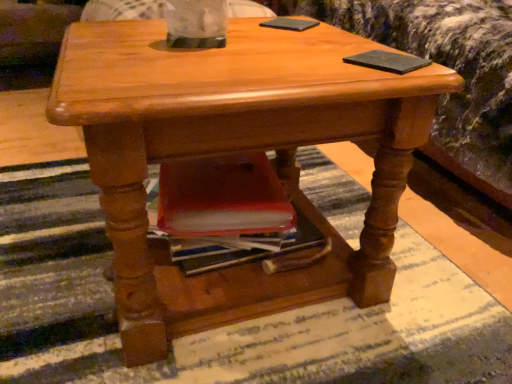
Question: Is black matte pad at upper right, positioned as the 1th pad in right-to-left order, oriented away from green matte pad at upper center, the 2th pad from the front?

Choices:
 (A) yes
 (B) no

Answer: (A)

Question: Is the depth of black matte pad at upper right, positioned as the second pad in back-to-front order, greater than that of green matte pad at upper center, acting as the second pad starting from the bottom?

Choices:
 (A) no
 (B) yes

Answer: (A)

Question: Would you say green matte pad at upper center, the 1th pad from the back, is part of black matte pad at upper right, positioned as the 1th pad in right-to-left order,'s contents?

Choices:
 (A) no
 (B) yes

Answer: (A)

Question: Does black matte pad at upper right, which is the first pad from bottom to top, have a lesser width compared to green matte pad at upper center, which is the first pad from left to right?

Choices:
 (A) no
 (B) yes

Answer: (B)

Question: Is black matte pad at upper right, positioned as the second pad in back-to-front order, at the right side of green matte pad at upper center, the second pad positioned from the right?

Choices:
 (A) no
 (B) yes

Answer: (B)

Question: Is black matte pad at upper right, positioned as the second pad in top-to-bottom order, located outside green matte pad at upper center, which ranks as the 1th pad in top-to-bottom order?

Choices:
 (A) yes
 (B) no

Answer: (A)

Question: Is green matte pad at upper center, acting as the second pad starting from the bottom, positioned with its back to black matte pad at upper right, which is the first pad from bottom to top?

Choices:
 (A) yes
 (B) no

Answer: (B)

Question: Can you confirm if green matte pad at upper center, which ranks as the 1th pad in top-to-bottom order, is smaller than black matte pad at upper right, which appears as the first pad when viewed from the front?

Choices:
 (A) no
 (B) yes

Answer: (A)

Question: Is green matte pad at upper center, the 1th pad from the back, to the right of black matte pad at upper right, positioned as the 1th pad in right-to-left order, from the viewer's perspective?

Choices:
 (A) no
 (B) yes

Answer: (A)

Question: Does green matte pad at upper center, which ranks as the 1th pad in top-to-bottom order, come behind black matte pad at upper right, which appears as the first pad when viewed from the front?

Choices:
 (A) yes
 (B) no

Answer: (A)

Question: Are green matte pad at upper center, the 2th pad from the front, and black matte pad at upper right, positioned as the second pad in back-to-front order, beside each other?

Choices:
 (A) yes
 (B) no

Answer: (B)

Question: Considering the relative sizes of green matte pad at upper center, the second pad positioned from the right, and black matte pad at upper right, placed as the second pad when sorted from left to right, in the image provided, is green matte pad at upper center, the second pad positioned from the right, wider than black matte pad at upper right, placed as the second pad when sorted from left to right,?

Choices:
 (A) yes
 (B) no

Answer: (A)

Question: Looking at the image, does green matte pad at upper center, acting as the second pad starting from the bottom, seem bigger or smaller compared to black matte pad at upper right, which is the first pad from bottom to top?

Choices:
 (A) big
 (B) small

Answer: (A)